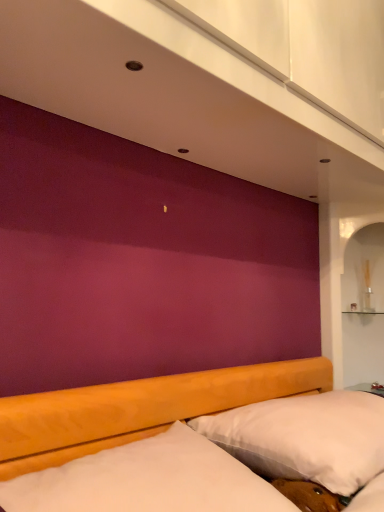
Question: Does metallic silver table at lower right have a greater width compared to white soft pillow at lower right?

Choices:
 (A) no
 (B) yes

Answer: (A)

Question: Considering the relative sizes of metallic silver table at lower right and white soft pillow at lower right in the image provided, is metallic silver table at lower right shorter than white soft pillow at lower right?

Choices:
 (A) yes
 (B) no

Answer: (A)

Question: Is metallic silver table at lower right bigger than white soft pillow at lower right?

Choices:
 (A) yes
 (B) no

Answer: (B)

Question: Does metallic silver table at lower right turn towards white soft pillow at lower right?

Choices:
 (A) no
 (B) yes

Answer: (A)

Question: From the image's perspective, is metallic silver table at lower right on top of white soft pillow at lower right?

Choices:
 (A) no
 (B) yes

Answer: (A)

Question: From the image's perspective, is white soft pillow at lower right located above or below white soft mattress at lower center?

Choices:
 (A) below
 (B) above

Answer: (A)

Question: Is white soft pillow at lower right to the left or to the right of white soft mattress at lower center in the image?

Choices:
 (A) right
 (B) left

Answer: (A)

Question: Considering the positions of point pos(362,402) and point pos(279,493), is point pos(362,402) closer or farther from the camera than point pos(279,493)?

Choices:
 (A) closer
 (B) farther

Answer: (B)

Question: Looking at their shapes, would you say white soft pillow at lower right is wider or thinner than white soft mattress at lower center?

Choices:
 (A) thin
 (B) wide

Answer: (A)

Question: Based on their sizes in the image, would you say white soft pillow at lower right is bigger or smaller than metallic silver table at lower right?

Choices:
 (A) big
 (B) small

Answer: (A)

Question: Does point (340, 439) appear closer or farther from the camera than point (382, 396)?

Choices:
 (A) closer
 (B) farther

Answer: (A)

Question: Looking at their shapes, would you say white soft pillow at lower right is wider or thinner than metallic silver table at lower right?

Choices:
 (A) wide
 (B) thin

Answer: (A)

Question: From the image's perspective, is white soft pillow at lower right positioned above or below metallic silver table at lower right?

Choices:
 (A) below
 (B) above

Answer: (B)

Question: In the image, is metallic silver table at lower right on the left side or the right side of white soft pillow at lower right?

Choices:
 (A) right
 (B) left

Answer: (A)

Question: From a real-world perspective, relative to white soft pillow at lower right, is metallic silver table at lower right vertically above or below?

Choices:
 (A) above
 (B) below

Answer: (B)